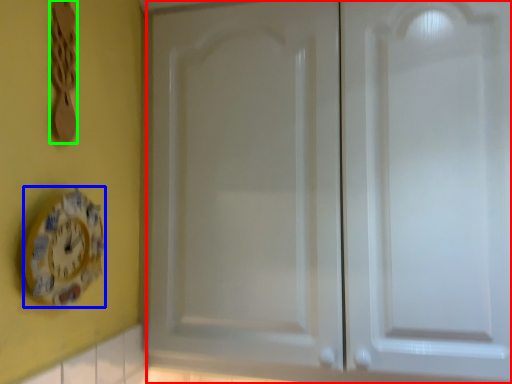
Question: Based on their relative distances, which object is farther from door (highlighted by a red box)? Choose from clock (highlighted by a blue box) and spoon (highlighted by a green box).

Choices:
 (A) clock
 (B) spoon

Answer: (B)